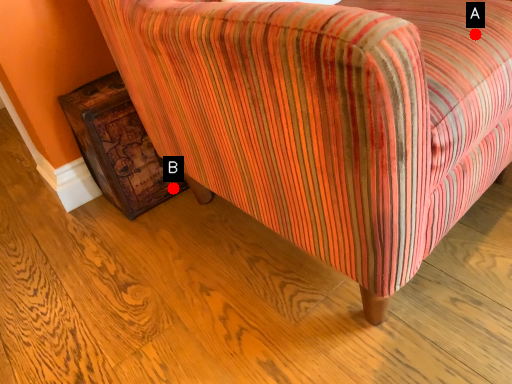
Question: Two points are circled on the image, labeled by A and B beside each circle. Which point is closer to the camera taking this photo?

Choices:
 (A) A is closer
 (B) B is closer

Answer: (A)